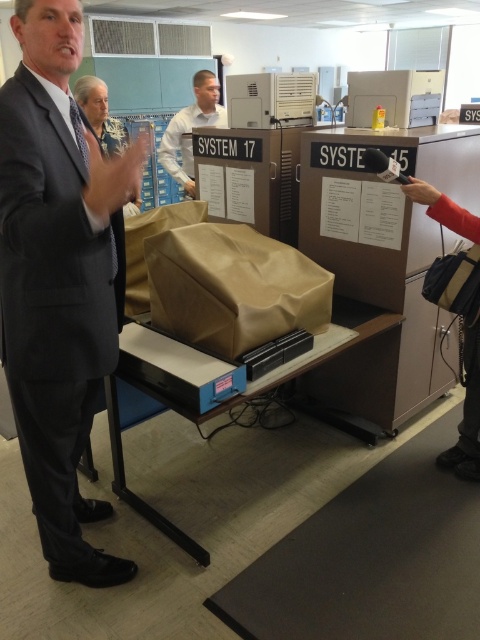
Question: Which object appears closest to the camera in this image?

Choices:
 (A) brown paper bag at center
 (B) matte black suit at left
 (C) white shirt at center

Answer: (B)

Question: From the image, what is the correct spatial relationship of brown paper bag at center in relation to white shirt at center?

Choices:
 (A) right
 (B) left

Answer: (A)

Question: From the image, what is the correct spatial relationship of matte black suit at left in relation to brown paper bag at center?

Choices:
 (A) right
 (B) left

Answer: (B)

Question: Which point appears closest to the camera in this image?

Choices:
 (A) (273, 237)
 (B) (11, 144)
 (C) (187, 154)

Answer: (B)

Question: Is brown paper bag at center thinner than white shirt at center?

Choices:
 (A) no
 (B) yes

Answer: (A)

Question: Which of the following is the closest to the observer?

Choices:
 (A) white shirt at center
 (B) brown paper bag at center
 (C) matte black suit at left

Answer: (C)